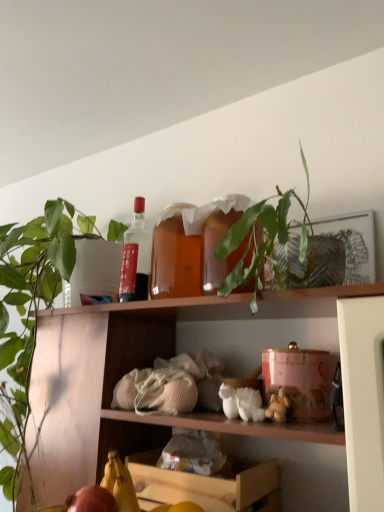
Question: Considering the relative sizes of matte glass bottle at upper center and matte red apple at lower left in the image provided, is matte glass bottle at upper center bigger than matte red apple at lower left?

Choices:
 (A) yes
 (B) no

Answer: (A)

Question: Does matte glass bottle at upper center have a greater height compared to matte red apple at lower left?

Choices:
 (A) no
 (B) yes

Answer: (B)

Question: Can you see matte glass bottle at upper center touching matte red apple at lower left?

Choices:
 (A) no
 (B) yes

Answer: (A)

Question: Can you confirm if matte glass bottle at upper center is thinner than matte red apple at lower left?

Choices:
 (A) yes
 (B) no

Answer: (B)

Question: From a real-world perspective, is matte glass bottle at upper center located higher than matte red apple at lower left?

Choices:
 (A) no
 (B) yes

Answer: (B)

Question: From the image's perspective, is matte glass bottle at upper center beneath matte red apple at lower left?

Choices:
 (A) no
 (B) yes

Answer: (A)

Question: Is green matte plant at upper left thinner than wooden crate at lower center?

Choices:
 (A) no
 (B) yes

Answer: (A)

Question: Does green matte plant at upper left appear on the right side of wooden crate at lower center?

Choices:
 (A) yes
 (B) no

Answer: (B)

Question: From the image's perspective, would you say green matte plant at upper left is shown under wooden crate at lower center?

Choices:
 (A) yes
 (B) no

Answer: (B)

Question: Does green matte plant at upper left have a lesser height compared to wooden crate at lower center?

Choices:
 (A) yes
 (B) no

Answer: (B)

Question: Considering the relative positions of green matte plant at upper left and wooden crate at lower center in the image provided, is green matte plant at upper left in front of wooden crate at lower center?

Choices:
 (A) yes
 (B) no

Answer: (A)

Question: From a real-world perspective, is green matte plant at upper left physically above wooden crate at lower center?

Choices:
 (A) no
 (B) yes

Answer: (B)

Question: Is green leafy plant at upper center at the right side of yellow matte banana at lower left?

Choices:
 (A) no
 (B) yes

Answer: (B)